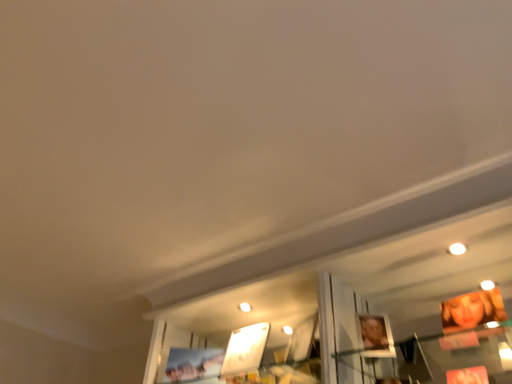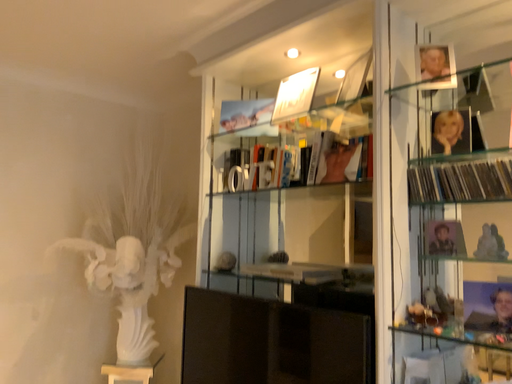
Question: Which way did the camera rotate in the video?

Choices:
 (A) rotated downward
 (B) rotated upward

Answer: (A)